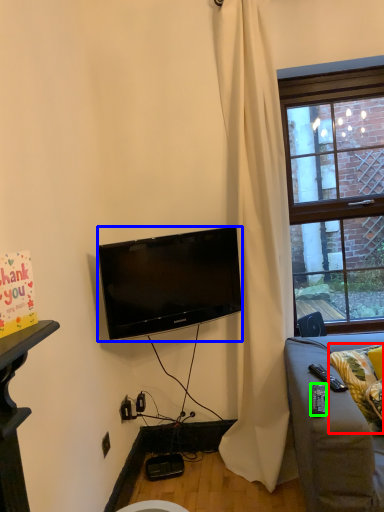
Question: Estimate the real-world distances between objects in this image. Which object is closer to pillow (highlighted by a red box), television (highlighted by a blue box) or remote control (highlighted by a green box)?

Choices:
 (A) television
 (B) remote control

Answer: (B)